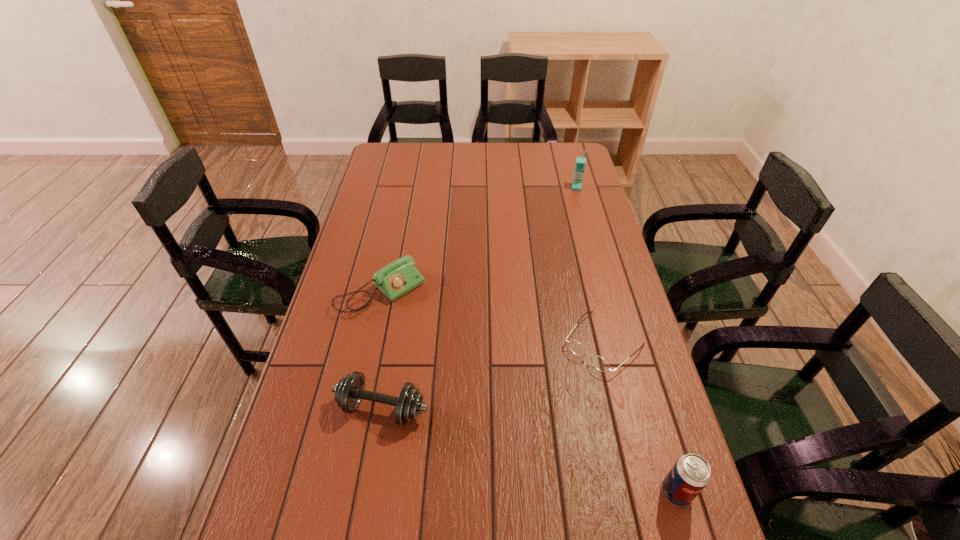
Locate an element on the screen. The height and width of the screenshot is (540, 960). the second nearest object is located at coordinates (349, 391).

Identify the location of dumbbell. (349, 391).

Locate an element on the screen. This screenshot has width=960, height=540. the nearest object is located at coordinates (691, 473).

Where is `the fourth shortest object`? the fourth shortest object is located at coordinates (691, 473).

Locate an element on the screen. telephone is located at coordinates (399, 277).

Find the location of a particular element. This screenshot has height=540, width=960. spectacles is located at coordinates (599, 363).

Find the location of a particular element. The height and width of the screenshot is (540, 960). the tallest object is located at coordinates (580, 161).

This screenshot has height=540, width=960. Find the location of `the farthest object`. the farthest object is located at coordinates (580, 161).

Where is `free spot located on the right of the third shortest object`? free spot located on the right of the third shortest object is located at coordinates (479, 408).

You are a GUI agent. You are given a task and a screenshot of the screen. Output one action in this format:
    pyautogui.click(x=<x>, y=<y>)
    Task: Click on the free space located 0.150m on the left of the beer can
    Image resolution: width=960 pixels, height=540 pixels.
    Given the screenshot: What is the action you would take?
    pyautogui.click(x=591, y=492)